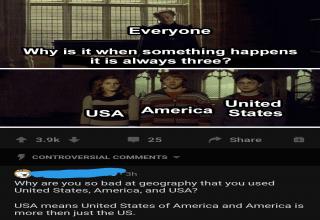
At what (x,y) coordinates should I click in order to perform the action: click on window. Please return your answer as a coordinate pair (x, y). The height and width of the screenshot is (220, 320). Looking at the image, I should click on (298, 86), (222, 88), (148, 81), (101, 15).